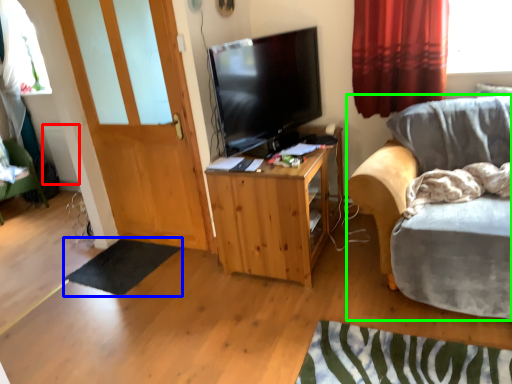
Question: Which is farther away from radiator (highlighted by a red box)? flat (highlighted by a blue box) or chair (highlighted by a green box)?

Choices:
 (A) flat
 (B) chair

Answer: (B)